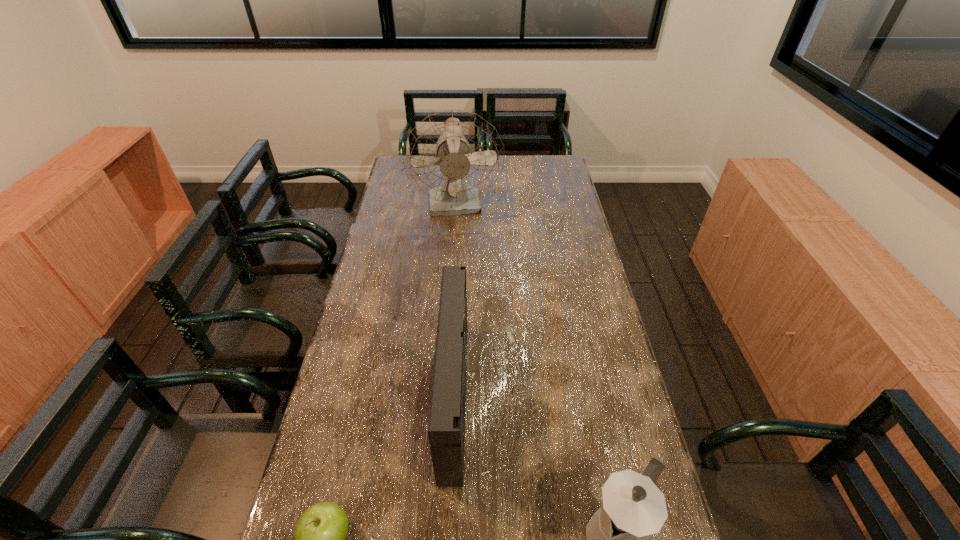
Locate an element on the screen. This screenshot has height=540, width=960. the farthest object is located at coordinates (454, 156).

At what (x,y) coordinates should I click in order to perform the action: click on the tallest object. Please return your answer as a coordinate pair (x, y). This screenshot has height=540, width=960. Looking at the image, I should click on (454, 156).

Locate an element on the screen. This screenshot has height=540, width=960. the second farthest object is located at coordinates (446, 428).

Identify the location of blank space located 0.220m in front of the farthest object to blow air. The image size is (960, 540). (454, 262).

Find the location of a particular element. This screenshot has width=960, height=540. vacant region located 0.140m on the side of the videotape with visible spindles is located at coordinates (517, 397).

Identify the location of object that is at the left edge. (454, 156).

The width and height of the screenshot is (960, 540). What are the coordinates of `free space at the left edge of the desktop` in the screenshot? It's located at pos(377,415).

The width and height of the screenshot is (960, 540). Find the location of `free space at the right edge`. free space at the right edge is located at coordinates (574, 228).

Find the location of a particular element. The height and width of the screenshot is (540, 960). object that is the second nearest to the videotape is located at coordinates (633, 509).

Choose which object is the second nearest neighbor to the coffeepot. Please provide its 2D coordinates. Your answer should be formatted as a tuple, i.e. [(x, y)], where the tuple contains the x and y coordinates of a point satisfying the conditions above.

[(320, 533)]